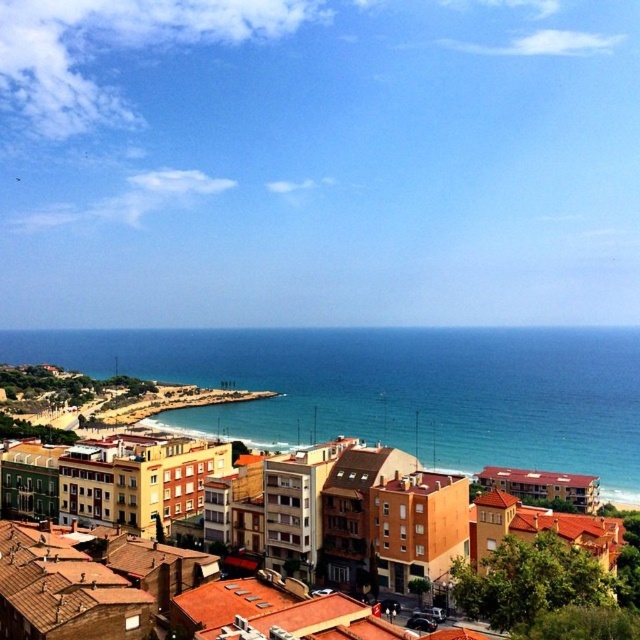
Is blue water at center smaller than brown matte building at center?

No.

Can you confirm if blue water at center is wider than brown matte building at center?

Yes, blue water at center is wider than brown matte building at center.

Where is `blue water at center`? The height and width of the screenshot is (640, 640). blue water at center is located at coordinates (396, 388).